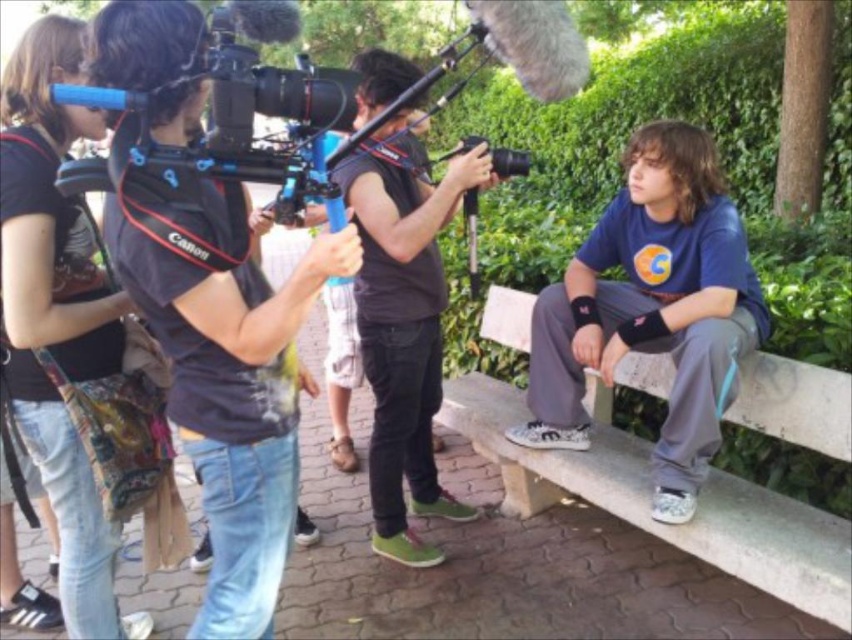
Question: Does denim jeans at center lie behind black plastic camera at center?

Choices:
 (A) yes
 (B) no

Answer: (B)

Question: Which object appears farthest from the camera in this image?

Choices:
 (A) blue cotton shirt at right
 (B) black plastic camera at center
 (C) concrete bench at right
 (D) denim jeans at center

Answer: (B)

Question: Is dark brown leather jacket at center above black plastic camera at center?

Choices:
 (A) yes
 (B) no

Answer: (B)

Question: Can you confirm if concrete bench at right is positioned to the right of denim jeans at center?

Choices:
 (A) yes
 (B) no

Answer: (A)

Question: Which object is the closest to the black plastic camera at center?

Choices:
 (A) denim jeans at center
 (B) concrete bench at right
 (C) dark brown leather jacket at center
 (D) black fabric camera at center

Answer: (C)

Question: Which point appears closest to the camera in this image?

Choices:
 (A) (691, 192)
 (B) (499, 176)
 (C) (85, 333)

Answer: (C)